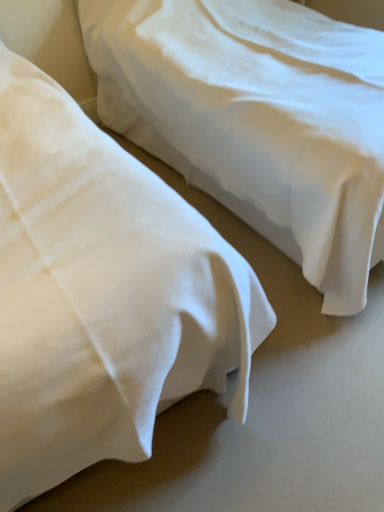
This screenshot has height=512, width=384. Describe the element at coordinates (257, 120) in the screenshot. I see `white smooth bed at center, positioned as the 1th bed in right-to-left order` at that location.

The image size is (384, 512). What are the coordinates of `white smooth bed at center, positioned as the 2th bed in left-to-right order` in the screenshot? It's located at (257, 120).

What is the approximate height of white cotton bed at center, acting as the first bed starting from the left?

white cotton bed at center, acting as the first bed starting from the left, is 3.96 feet in height.

The image size is (384, 512). What do you see at coordinates (102, 294) in the screenshot?
I see `white cotton bed at center, which is the second bed from right to left` at bounding box center [102, 294].

Locate an element on the screen. white cotton bed at center, acting as the first bed starting from the left is located at coordinates (102, 294).

Where is `white smooth bed at center, positioned as the 1th bed in right-to-left order`? Image resolution: width=384 pixels, height=512 pixels. white smooth bed at center, positioned as the 1th bed in right-to-left order is located at coordinates (257, 120).

Can you confirm if white smooth bed at center, positioned as the 1th bed in right-to-left order, is positioned to the right of white cotton bed at center, acting as the first bed starting from the left?

Yes, white smooth bed at center, positioned as the 1th bed in right-to-left order, is to the right of white cotton bed at center, acting as the first bed starting from the left.

Relative to white cotton bed at center, acting as the first bed starting from the left, is white smooth bed at center, positioned as the 2th bed in left-to-right order, in front or behind?

white smooth bed at center, positioned as the 2th bed in left-to-right order, is positioned farther from the viewer than white cotton bed at center, acting as the first bed starting from the left.

Considering the points (117, 46) and (56, 99), which point is behind, point (117, 46) or point (56, 99)?

The point (117, 46) is farther from the camera.

From the image's perspective, does white smooth bed at center, positioned as the 1th bed in right-to-left order, appear higher than white cotton bed at center, which is the second bed from right to left?

Indeed, from the image's perspective, white smooth bed at center, positioned as the 1th bed in right-to-left order, is shown above white cotton bed at center, which is the second bed from right to left.

From a real-world perspective, which is physically above, white smooth bed at center, positioned as the 2th bed in left-to-right order, or white cotton bed at center, which is the second bed from right to left?

From a 3D spatial view, white cotton bed at center, which is the second bed from right to left, is above.

Considering the sizes of objects white smooth bed at center, positioned as the 1th bed in right-to-left order, and white cotton bed at center, which is the second bed from right to left, in the image provided, who is wider, white smooth bed at center, positioned as the 1th bed in right-to-left order, or white cotton bed at center, which is the second bed from right to left,?

white cotton bed at center, which is the second bed from right to left.

Consider the image. Is white smooth bed at center, positioned as the 2th bed in left-to-right order, taller than white cotton bed at center, which is the second bed from right to left?

Incorrect, the height of white smooth bed at center, positioned as the 2th bed in left-to-right order, is not larger of that of white cotton bed at center, which is the second bed from right to left.

Does white smooth bed at center, positioned as the 2th bed in left-to-right order, have a smaller size compared to white cotton bed at center, which is the second bed from right to left?

No, white smooth bed at center, positioned as the 2th bed in left-to-right order, is not smaller than white cotton bed at center, which is the second bed from right to left.

Would you say white smooth bed at center, positioned as the 2th bed in left-to-right order, is inside or outside white cotton bed at center, acting as the first bed starting from the left?

white smooth bed at center, positioned as the 2th bed in left-to-right order, is outside white cotton bed at center, acting as the first bed starting from the left.

Is white smooth bed at center, positioned as the 1th bed in right-to-left order, not near white cotton bed at center, acting as the first bed starting from the left?

They are positioned close to each other.

Does white smooth bed at center, positioned as the 2th bed in left-to-right order, turn towards white cotton bed at center, acting as the first bed starting from the left?

No.

In the scene shown: Can you tell me how much white smooth bed at center, positioned as the 2th bed in left-to-right order, and white cotton bed at center, acting as the first bed starting from the left, differ in facing direction?

0.00012 degrees separate the facing orientations of white smooth bed at center, positioned as the 2th bed in left-to-right order, and white cotton bed at center, acting as the first bed starting from the left.

The width and height of the screenshot is (384, 512). Identify the location of bed on the left of white smooth bed at center, positioned as the 2th bed in left-to-right order. (102, 294).

Would you say white cotton bed at center, acting as the first bed starting from the left, is to the left or to the right of white smooth bed at center, positioned as the 2th bed in left-to-right order, in the picture?

In the image, white cotton bed at center, acting as the first bed starting from the left, appears on the left side of white smooth bed at center, positioned as the 2th bed in left-to-right order.

Between white cotton bed at center, which is the second bed from right to left, and white smooth bed at center, positioned as the 2th bed in left-to-right order, which one is positioned in front?

Positioned in front is white cotton bed at center, which is the second bed from right to left.

Is point (32, 338) closer to camera compared to point (318, 94)?

Yes, point (32, 338) is closer to viewer.

From the image's perspective, is white cotton bed at center, acting as the first bed starting from the left, on top of white smooth bed at center, positioned as the 1th bed in right-to-left order?

No, from the image's perspective, white cotton bed at center, acting as the first bed starting from the left, is not above white smooth bed at center, positioned as the 1th bed in right-to-left order.

From a real-world perspective, is white cotton bed at center, acting as the first bed starting from the left, under white smooth bed at center, positioned as the 2th bed in left-to-right order?

Incorrect, from a real-world perspective, white cotton bed at center, acting as the first bed starting from the left, is higher than white smooth bed at center, positioned as the 2th bed in left-to-right order.

Is white cotton bed at center, acting as the first bed starting from the left, thinner than white smooth bed at center, positioned as the 1th bed in right-to-left order?

Incorrect, the width of white cotton bed at center, acting as the first bed starting from the left, is not less than that of white smooth bed at center, positioned as the 1th bed in right-to-left order.

Does white cotton bed at center, acting as the first bed starting from the left, have a lesser height compared to white smooth bed at center, positioned as the 1th bed in right-to-left order?

No, white cotton bed at center, acting as the first bed starting from the left, is not shorter than white smooth bed at center, positioned as the 1th bed in right-to-left order.

Who is smaller, white cotton bed at center, which is the second bed from right to left, or white smooth bed at center, positioned as the 2th bed in left-to-right order?

white cotton bed at center, which is the second bed from right to left.

Is white smooth bed at center, positioned as the 1th bed in right-to-left order, surrounded by white cotton bed at center, acting as the first bed starting from the left?

No, white smooth bed at center, positioned as the 1th bed in right-to-left order, is not surrounded by white cotton bed at center, acting as the first bed starting from the left.

Does white cotton bed at center, acting as the first bed starting from the left, touch white smooth bed at center, positioned as the 1th bed in right-to-left order?

white cotton bed at center, acting as the first bed starting from the left, is not next to white smooth bed at center, positioned as the 1th bed in right-to-left order, and they're not touching.

Could you tell me if white cotton bed at center, which is the second bed from right to left, is facing white smooth bed at center, positioned as the 2th bed in left-to-right order?

No, white cotton bed at center, which is the second bed from right to left, does not turn towards white smooth bed at center, positioned as the 2th bed in left-to-right order.

How different are the orientations of white cotton bed at center, acting as the first bed starting from the left, and white smooth bed at center, positioned as the 2th bed in left-to-right order, in degrees?

0.00012 degrees.

Image resolution: width=384 pixels, height=512 pixels. Identify the location of bed lying behind the white cotton bed at center, acting as the first bed starting from the left. (257, 120).

Where is `bed on the right of white cotton bed at center, acting as the first bed starting from the left`? Image resolution: width=384 pixels, height=512 pixels. bed on the right of white cotton bed at center, acting as the first bed starting from the left is located at coordinates (257, 120).

At what (x,y) coordinates should I click in order to perform the action: click on bed in front of the white smooth bed at center, positioned as the 2th bed in left-to-right order. Please return your answer as a coordinate pair (x, y). Looking at the image, I should click on (102, 294).